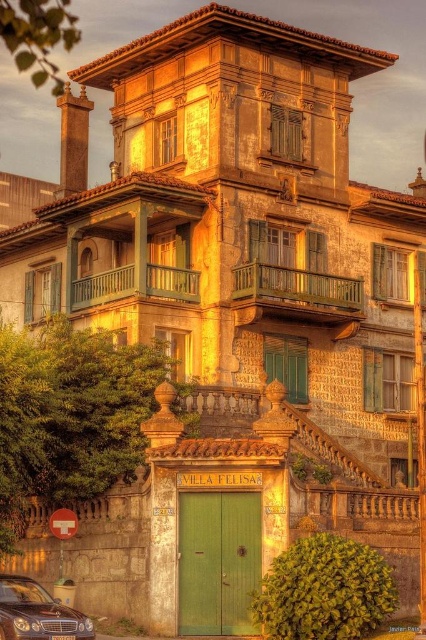
You are a photographer planning to take a photo of the villa from the street. You want to ensure that the shiny dark brown car at lower left does not block the view of the wooden balcony at center. Based on their heights, is this possible?

The shiny dark brown car at lower left has a lesser height compared to the wooden balcony at center. Therefore, the car is shorter than the balcony, so it won not block the view of the wooden balcony at center if positioned appropriately.

Based on the scene description, where is the green wooden balcony at center located in the image?

The green wooden balcony at center is located at point 0.461 in the x coordinate and 0.692 in the y coordinate.